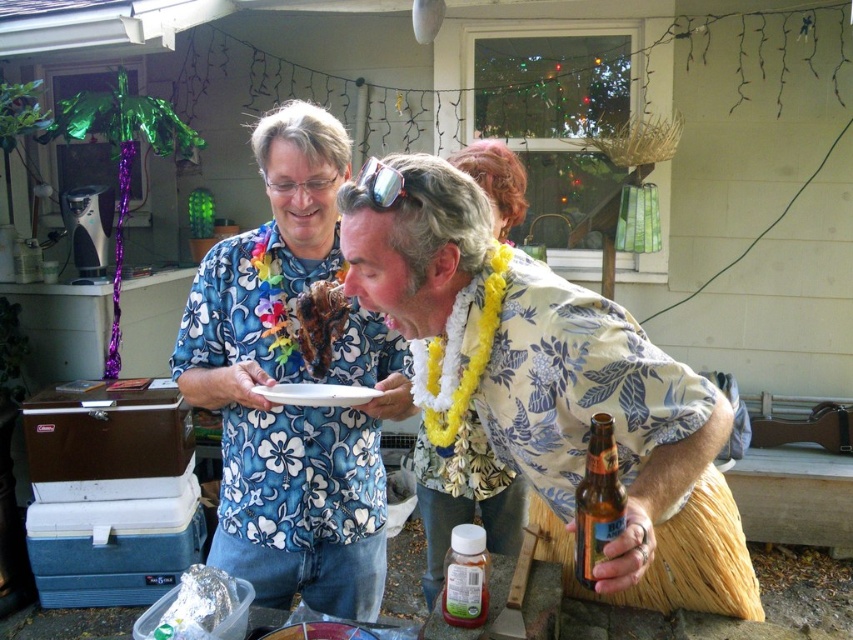
Is floral fabric shirt at center positioned before brown crispy meat at center?

Yes.

Locate an element on the screen. floral fabric shirt at center is located at coordinates tap(541, 388).

Does floral fabric shirt at center have a greater width compared to blue floral shirt at center?

Yes, floral fabric shirt at center is wider than blue floral shirt at center.

Is point (326, 168) positioned behind point (322, 256)?

No, (326, 168) is in front of (322, 256).

You are a GUI agent. You are given a task and a screenshot of the screen. Output one action in this format:
    pyautogui.click(x=<x>, y=<y>)
    Task: Click on the floral fabric shirt at center
    Image resolution: width=853 pixels, height=640 pixels.
    Given the screenshot: What is the action you would take?
    pyautogui.click(x=541, y=388)

Find the location of a particular element. This screenshot has width=853, height=640. floral fabric shirt at center is located at coordinates (541, 388).

Does translucent plastic bottle at lower center have a smaller size compared to brown crispy meat at center?

No, translucent plastic bottle at lower center is not smaller than brown crispy meat at center.

Which is more to the left, translucent plastic bottle at lower center or brown crispy meat at center?

Positioned to the left is brown crispy meat at center.

Does point (469, 563) come in front of point (300, 298)?

That is True.

At what (x,y) coordinates should I click in order to perform the action: click on translucent plastic bottle at lower center. Please return your answer as a coordinate pair (x, y). This screenshot has width=853, height=640. Looking at the image, I should click on (465, 577).